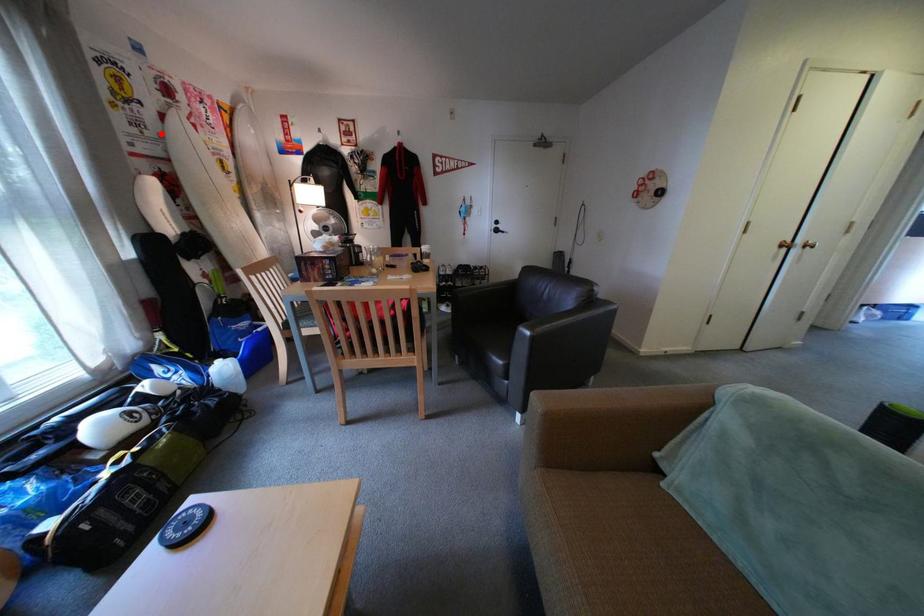
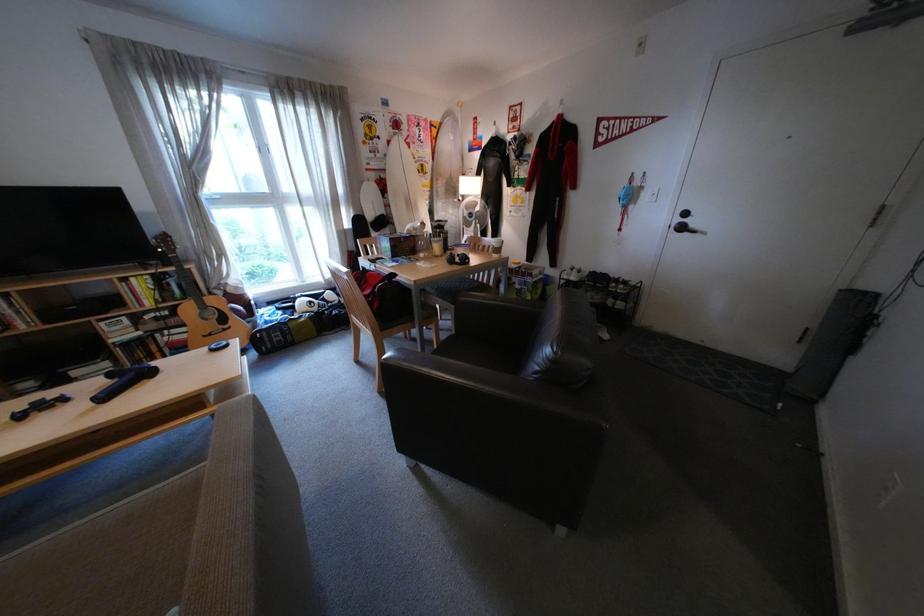
Question: I am providing you with two images of the same scene from different viewpoints. In image1, a red point is highlighted. Considering the same 3D point in image2, which of the following is correct?

Choices:
 (A) It is closer
 (B) It is farther

Answer: (A)